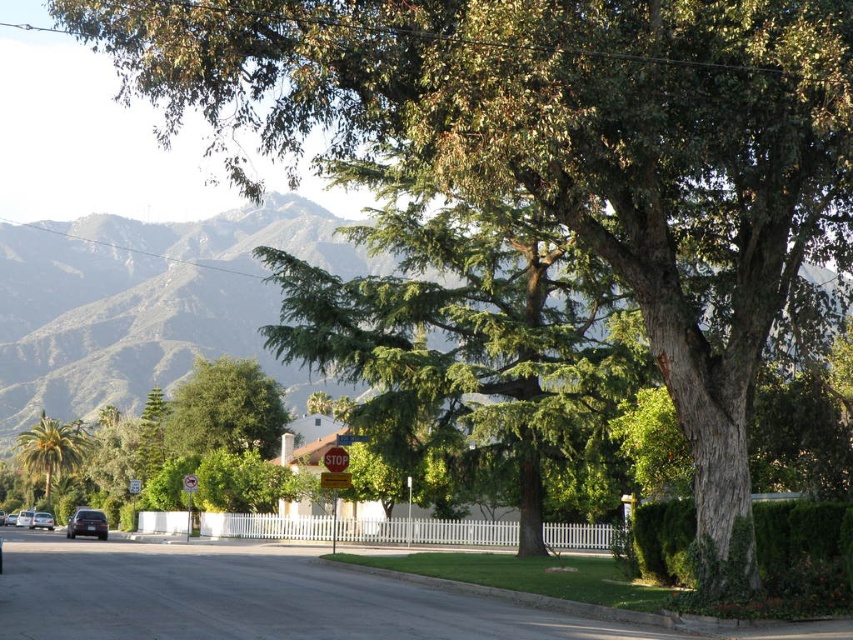
Does green leafy mountain at upper center have a greater width compared to green leafy palm tree at left?

Yes.

Does green leafy mountain at upper center come in front of green leafy palm tree at left?

Yes, green leafy mountain at upper center is in front of green leafy palm tree at left.

The image size is (853, 640). I want to click on green leafy mountain at upper center, so click(x=148, y=301).

Is shiny black sedan at lower left thinner than metallic reflective stop sign at center?

Yes, shiny black sedan at lower left is thinner than metallic reflective stop sign at center.

Does shiny black sedan at lower left appear on the right side of metallic reflective stop sign at center?

No, shiny black sedan at lower left is not to the right of metallic reflective stop sign at center.

Identify the location of shiny black sedan at lower left. The height and width of the screenshot is (640, 853). 86,524.

Who is taller, metallic reflective stop sign at center or silver metallic car at lower left?

metallic reflective stop sign at center is taller.

Between metallic reflective stop sign at center and silver metallic car at lower left, which one has less height?

Standing shorter between the two is silver metallic car at lower left.

Who is more forward, (190, 481) or (45, 515)?

Positioned in front is point (190, 481).

This screenshot has height=640, width=853. I want to click on metallic reflective stop sign at center, so [189, 499].